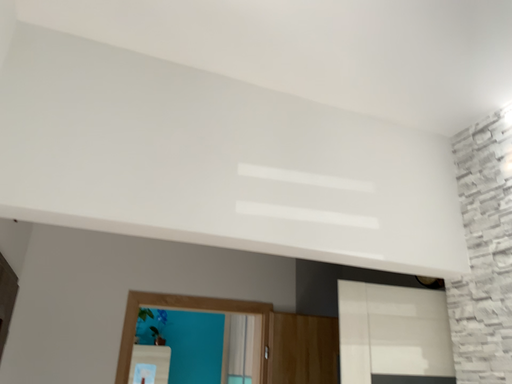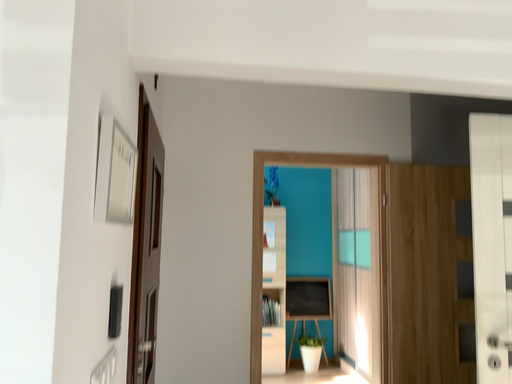
Question: Which way did the camera rotate in the video?

Choices:
 (A) rotated right
 (B) rotated left

Answer: (B)